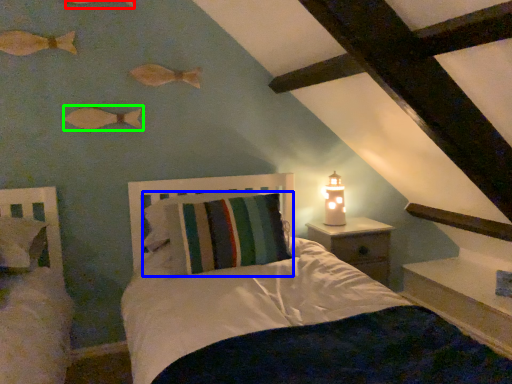
Question: Which object is the closest to the fish (highlighted by a red box)? Choose among these: pillow (highlighted by a blue box) or fish (highlighted by a green box).

Choices:
 (A) pillow
 (B) fish

Answer: (B)